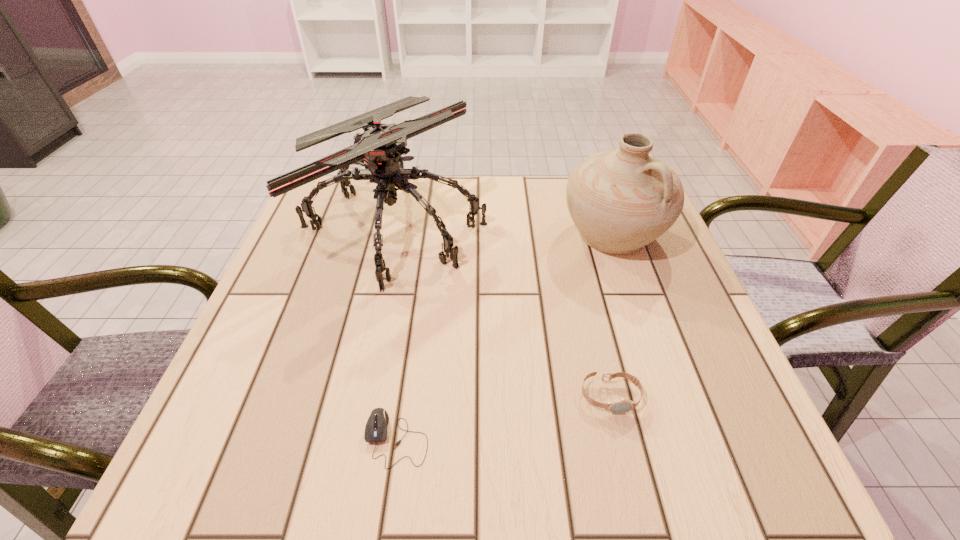
This screenshot has height=540, width=960. In the image, there is a desktop. Find the location of `vacant region at the near right corner`. vacant region at the near right corner is located at coordinates (779, 479).

This screenshot has height=540, width=960. Find the location of `vacant space in between the pottery and the drone`. vacant space in between the pottery and the drone is located at coordinates (504, 230).

I want to click on blank region between the drone and the watch, so click(502, 311).

Locate an element on the screen. This screenshot has height=540, width=960. empty space between the shortest object and the third tallest object is located at coordinates (503, 417).

Identify the location of blank region between the drone and the third tallest object. (502, 311).

You are a GUI agent. You are given a task and a screenshot of the screen. Output one action in this format:
    pyautogui.click(x=<x>, y=<y>)
    Task: Click on the free point between the second shortest object and the drone
    
    Given the screenshot: What is the action you would take?
    pyautogui.click(x=502, y=311)

At what (x,y) coordinates should I click in order to perform the action: click on vacant space that is in between the second shortest object and the shortest object. Please return your answer as a coordinate pair (x, y). Image resolution: width=960 pixels, height=540 pixels. Looking at the image, I should click on (503, 417).

Locate an element on the screen. free spot between the second shortest object and the drone is located at coordinates (502, 311).

This screenshot has height=540, width=960. In order to click on blank region between the drone and the computer mouse in this screenshot , I will do `click(396, 332)`.

Find the location of `free space that is in between the pottery and the second shortest object`. free space that is in between the pottery and the second shortest object is located at coordinates (612, 315).